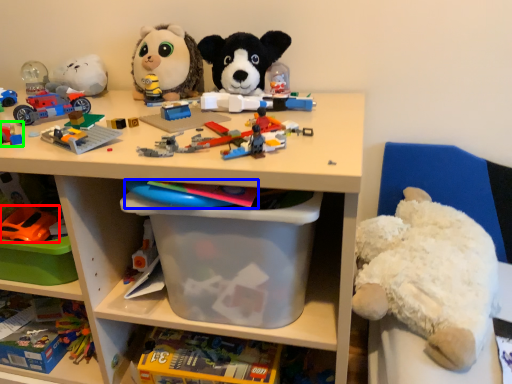
Question: Which object is positioned farthest from toy (highlighted by a red box)? Select from toy (highlighted by a blue box) and toy (highlighted by a green box).

Choices:
 (A) toy
 (B) toy

Answer: (A)